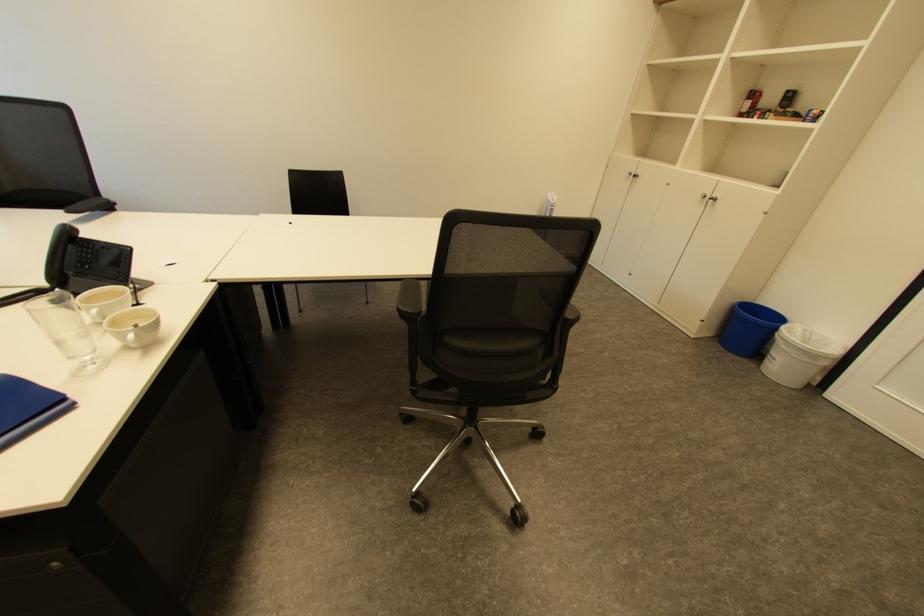
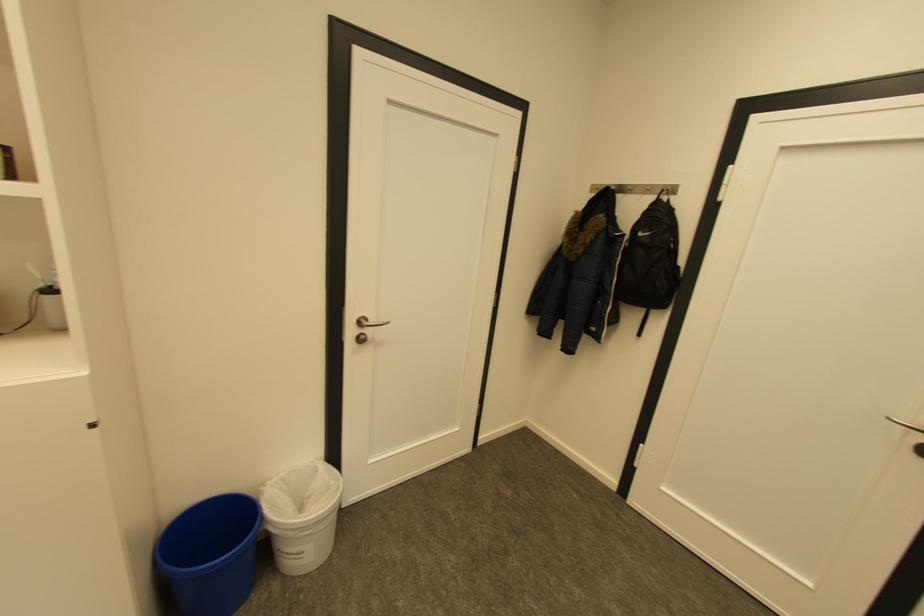
Where in the second image is the point corresponding to the point at 819,331 from the first image?

(289, 477)